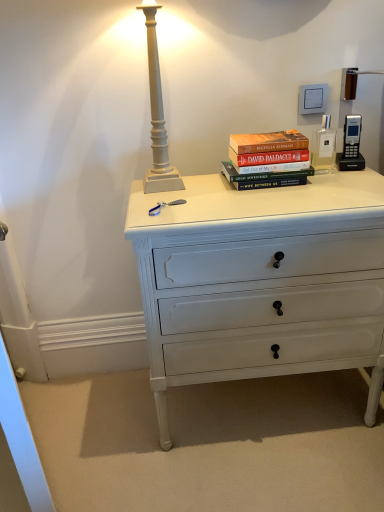
Find the location of a particular element. The width and height of the screenshot is (384, 512). free point above hardcover books at center (from a real-world perspective) is located at coordinates pos(275,136).